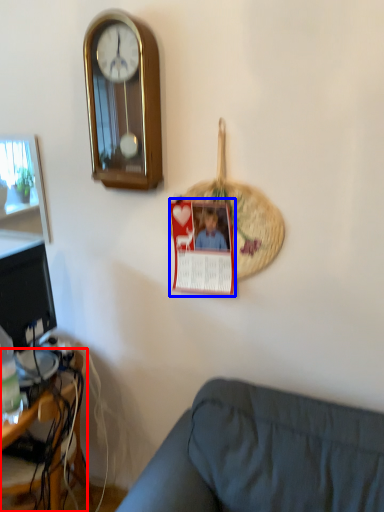
Question: Which object appears farthest to the camera in this image, desk (highlighted by a red box) or postcard (highlighted by a blue box)?

Choices:
 (A) desk
 (B) postcard

Answer: (A)